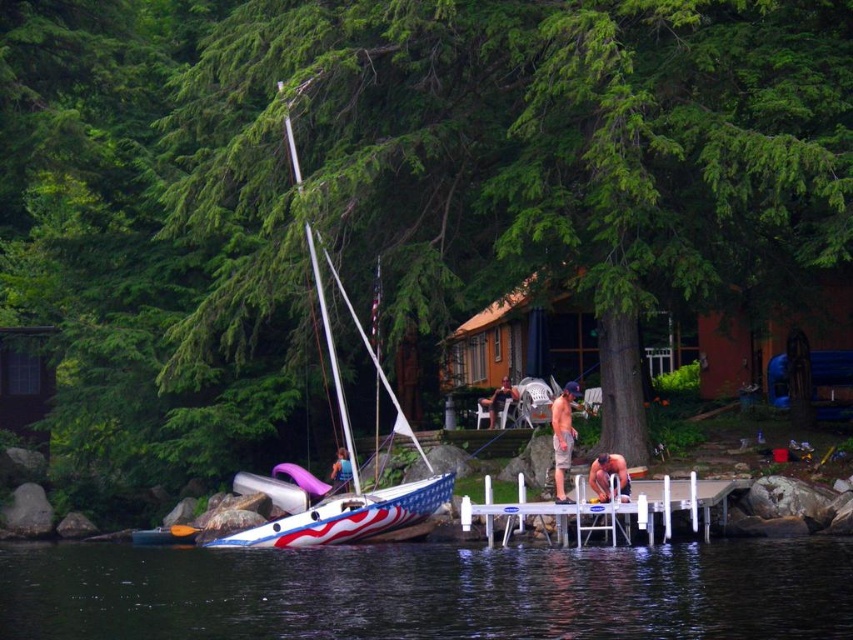
Looking at this image, you are planning to place a new bench on the lakeside dock. The bench requires a space larger than the matte white sailboat at center. Can the white plastic dock at center accommodate the bench?

The white plastic dock at center is larger in size than the matte white sailboat at center, so it can accommodate the bench as it requires a space larger than the sailboat.

You are standing on the white plastic dock at center and want to reach the matte white sailboat at center. Which direction should you move to get there?

The white plastic dock at center is located above the matte white sailboat at center, so you should move downward to reach it.

You are standing on the dock and want to sit down. There is a smooth white chair at center and a smooth tan skin at lower right. Which object is closer to your current position on the dock?

The smooth tan skin at lower right is located below the smooth white chair at center, so the smooth white chair at center is closer to your current position on the dock.